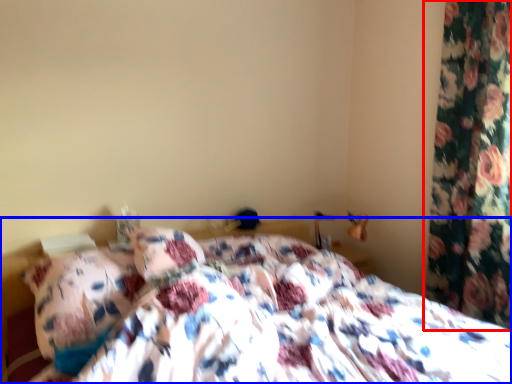
Question: Among these objects, which one is nearest to the camera, curtain (highlighted by a red box) or bed (highlighted by a blue box)?

Choices:
 (A) curtain
 (B) bed

Answer: (B)